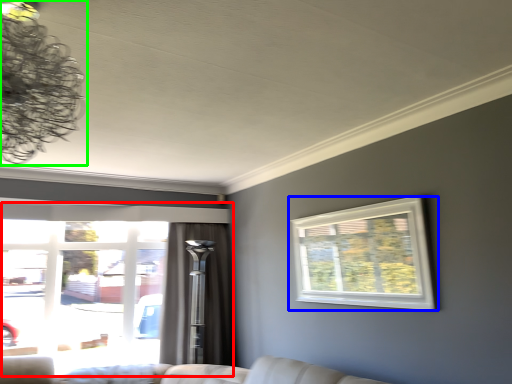
Question: Which object is positioned closest to window (highlighted by a red box)? Select from window (highlighted by a blue box) and lamp (highlighted by a green box).

Choices:
 (A) window
 (B) lamp

Answer: (A)